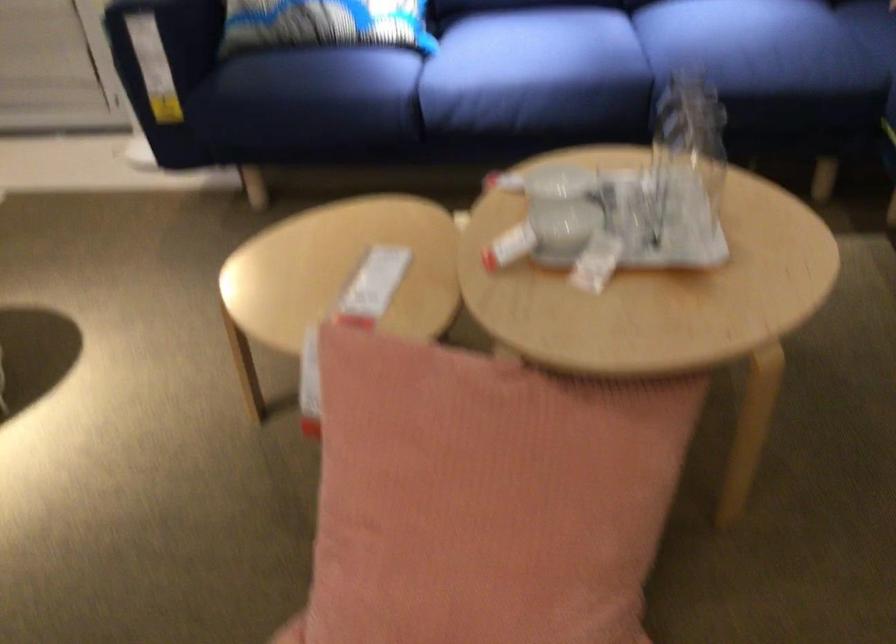
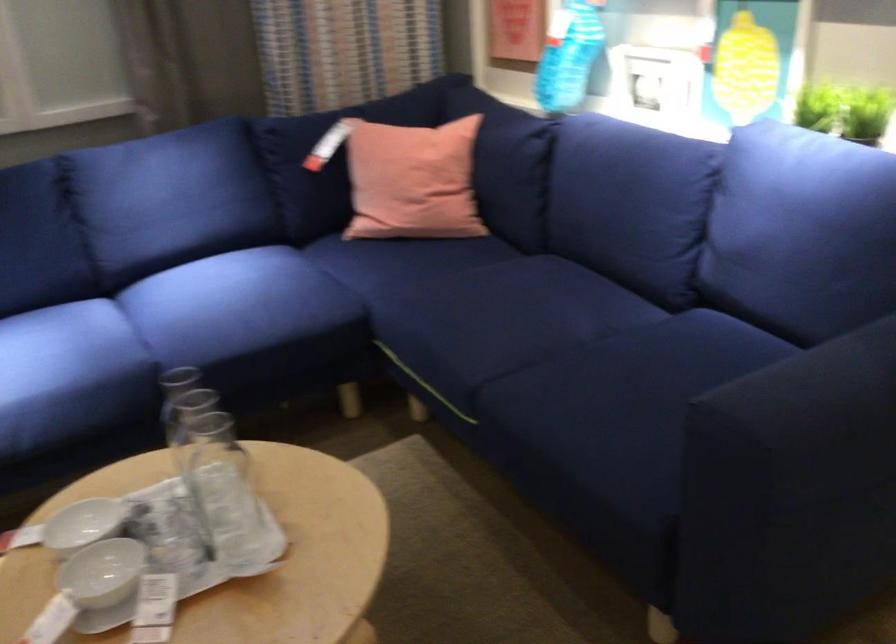
Locate, in the second image, the point that corresponds to pixel 541 185 in the first image.

(83, 524)